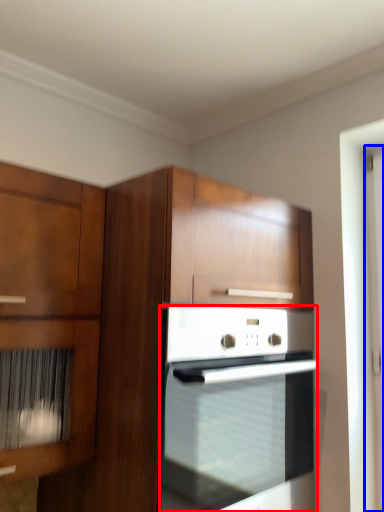
Question: Which object is further to the camera taking this photo, oven (highlighted by a red box) or screen door (highlighted by a blue box)?

Choices:
 (A) oven
 (B) screen door

Answer: (B)